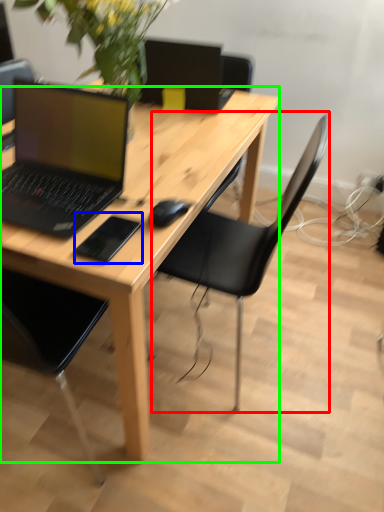
Question: Estimate the real-world distances between objects in this image. Which object is farther from chair (highlighted by a red box), mousepad (highlighted by a blue box) or desk (highlighted by a green box)?

Choices:
 (A) mousepad
 (B) desk

Answer: (A)